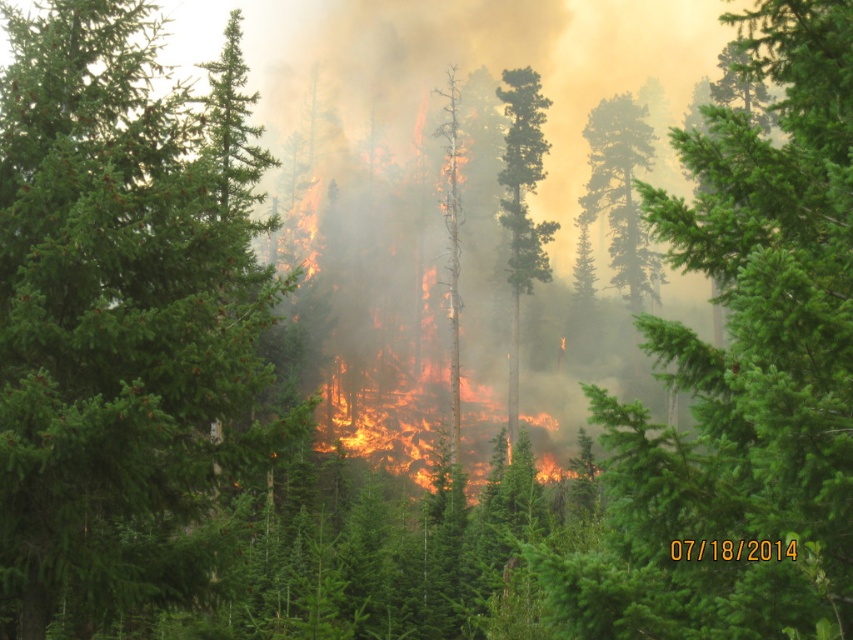
Does green evergreen tree at center have a lesser width compared to green smooth bark tree at center?

Incorrect, green evergreen tree at center's width is not less than green smooth bark tree at center's.

Is the position of green evergreen tree at center less distant than that of green smooth bark tree at center?

Yes.

Who is more distant from viewer, [137,424] or [532,84]?

The point [532,84] is more distant.

At what (x,y) coordinates should I click in order to perform the action: click on green evergreen tree at center. Please return your answer as a coordinate pair (x, y). The height and width of the screenshot is (640, 853). Looking at the image, I should click on 120,314.

Is green evergreen tree at center to the left of green matte tree at center from the viewer's perspective?

Yes, green evergreen tree at center is to the left of green matte tree at center.

Can you confirm if green evergreen tree at center is wider than green matte tree at center?

Incorrect, green evergreen tree at center's width does not surpass green matte tree at center's.

This screenshot has width=853, height=640. What are the coordinates of `green evergreen tree at center` in the screenshot? It's located at (120, 314).

Looking at this image, is green matte tree at center to the left of green smooth bark tree at center from the viewer's perspective?

No, green matte tree at center is not to the left of green smooth bark tree at center.

Based on the photo, can you confirm if green matte tree at center is bigger than green smooth bark tree at center?

Yes, green matte tree at center is bigger than green smooth bark tree at center.

Which is behind, point (721, 630) or point (509, 100)?

The point (509, 100) is more distant.

At what (x,y) coordinates should I click in order to perform the action: click on green matte tree at center. Please return your answer as a coordinate pair (x, y). Image resolution: width=853 pixels, height=640 pixels. Looking at the image, I should click on (741, 372).